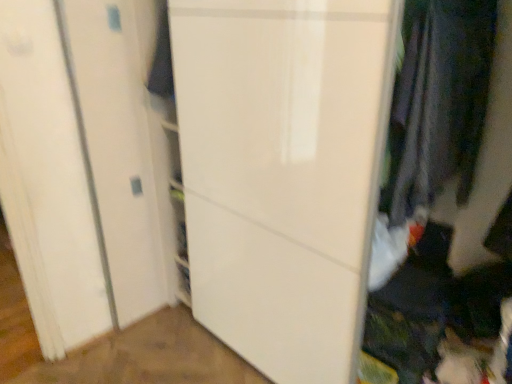
Image resolution: width=512 pixels, height=384 pixels. What do you see at coordinates (439, 102) in the screenshot?
I see `dark gray fabric at right` at bounding box center [439, 102].

What is the approximate width of dark gray fabric at right?

dark gray fabric at right is 17.73 inches in width.

Locate an element on the screen. This screenshot has width=512, height=384. dark gray fabric at right is located at coordinates (439, 102).

The width and height of the screenshot is (512, 384). What are the coordinates of `white glossy door at center` in the screenshot? It's located at (283, 172).

The height and width of the screenshot is (384, 512). What do you see at coordinates (283, 172) in the screenshot?
I see `white glossy door at center` at bounding box center [283, 172].

Where is `dark gray fabric at right`? The height and width of the screenshot is (384, 512). dark gray fabric at right is located at coordinates (439, 102).

Considering the relative positions of dark gray fabric at right and white glossy door at center in the image provided, is dark gray fabric at right to the left or to the right of white glossy door at center?

From the image, it's evident that dark gray fabric at right is to the right of white glossy door at center.

Considering their positions, is dark gray fabric at right located in front of or behind white glossy door at center?

In the image, dark gray fabric at right appears behind white glossy door at center.

Does point (460, 152) come behind point (292, 364)?

No, it is not.

Looking at this image, from the image's perspective, is dark gray fabric at right positioned above or below white glossy door at center?

Based on their image positions, dark gray fabric at right is located above white glossy door at center.

From a real-world perspective, which object rests below the other?

From a 3D spatial view, white glossy door at center is below.

Considering the sizes of dark gray fabric at right and white glossy door at center in the image, is dark gray fabric at right wider or thinner than white glossy door at center?

dark gray fabric at right is thinner than white glossy door at center.

Considering the relative sizes of dark gray fabric at right and white glossy door at center in the image provided, is dark gray fabric at right shorter than white glossy door at center?

Indeed, dark gray fabric at right has a lesser height compared to white glossy door at center.

Considering the sizes of dark gray fabric at right and white glossy door at center in the image, is dark gray fabric at right bigger or smaller than white glossy door at center?

Clearly, dark gray fabric at right is smaller in size than white glossy door at center.

Is dark gray fabric at right outside of white glossy door at center?

No.

Is dark gray fabric at right touching white glossy door at center?

dark gray fabric at right and white glossy door at center are not in contact.

Could you tell me if dark gray fabric at right is facing white glossy door at center?

Yes, dark gray fabric at right is facing white glossy door at center.

How many degrees apart are the facing directions of dark gray fabric at right and white glossy door at center?

0.000174 degrees.

I want to click on clothing above the white glossy door at center (from the image's perspective), so click(x=439, y=102).

Consider the image. Is white glossy door at center to the left of dark gray fabric at right from the viewer's perspective?

Indeed, white glossy door at center is positioned on the left side of dark gray fabric at right.

Between white glossy door at center and dark gray fabric at right, which one is positioned behind?

dark gray fabric at right is further away from the camera.

Between point (360, 111) and point (408, 82), which one is positioned in front?

The point (360, 111) is more forward.

From the image's perspective, does white glossy door at center appear higher than dark gray fabric at right?

No, from the image's perspective, white glossy door at center is not over dark gray fabric at right.

From a real-world perspective, is white glossy door at center physically above dark gray fabric at right?

Actually, white glossy door at center is physically below dark gray fabric at right in the real world.

Is white glossy door at center wider or thinner than dark gray fabric at right?

Considering their sizes, white glossy door at center looks broader than dark gray fabric at right.

Can you confirm if white glossy door at center is taller than dark gray fabric at right?

Correct, white glossy door at center is much taller as dark gray fabric at right.

Is white glossy door at center smaller than dark gray fabric at right?

No, white glossy door at center is not smaller than dark gray fabric at right.

From the picture: Is dark gray fabric at right surrounded by white glossy door at center?

That's correct, dark gray fabric at right is inside white glossy door at center.

Is white glossy door at center beside dark gray fabric at right?

white glossy door at center and dark gray fabric at right are not in contact.

From the picture: Is dark gray fabric at right at the back of white glossy door at center?

That's right, white glossy door at center is facing away from dark gray fabric at right.

Looking at this image, can you tell me how much white glossy door at center and dark gray fabric at right differ in facing direction?

The facing directions of white glossy door at center and dark gray fabric at right are 0.000174 degrees apart.

Locate an element on the screen. This screenshot has height=384, width=512. clothing lying on the right of white glossy door at center is located at coordinates [439, 102].

Identify the location of clothing behind the white glossy door at center. The width and height of the screenshot is (512, 384). (439, 102).

This screenshot has height=384, width=512. Find the location of `door that is on the left side of dark gray fabric at right`. door that is on the left side of dark gray fabric at right is located at coordinates (283, 172).